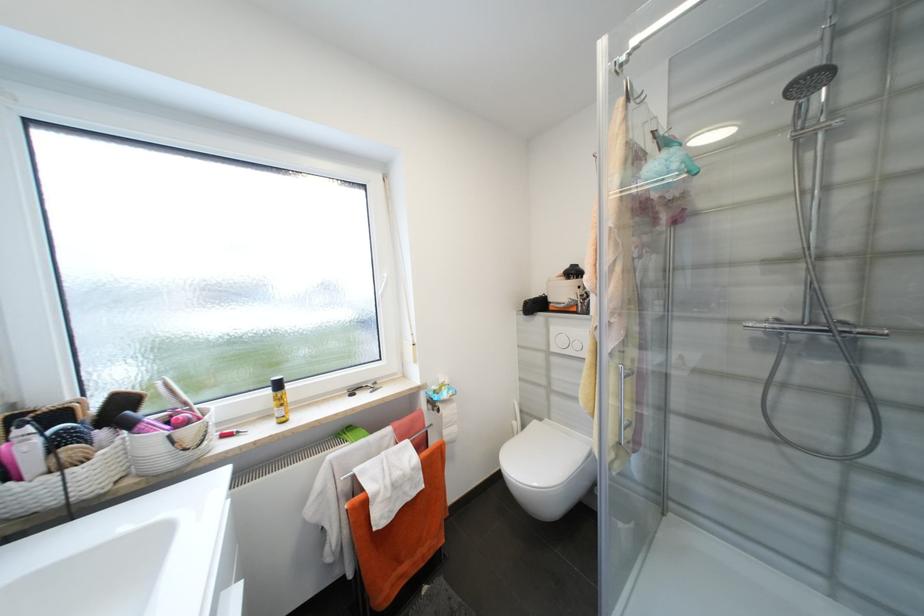
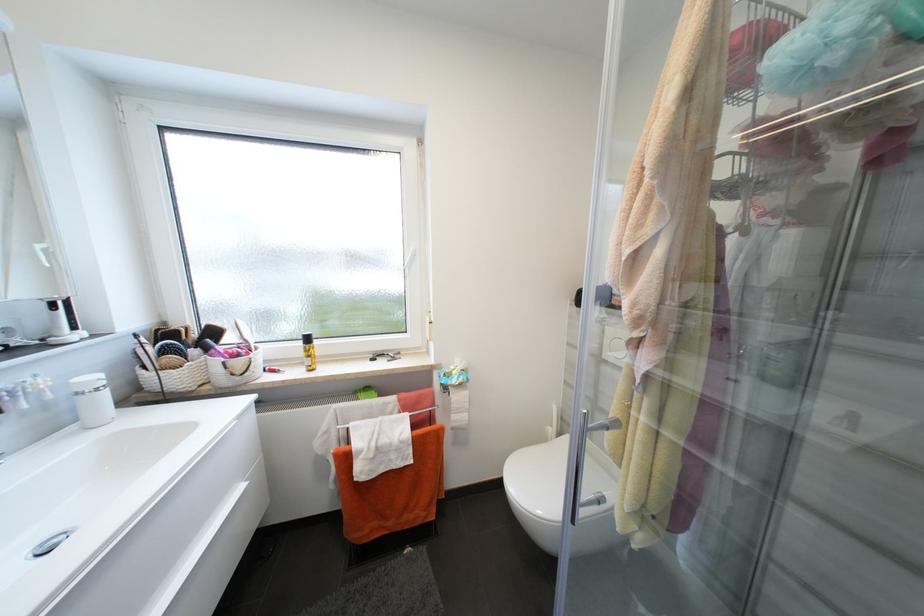
In a continuous first-person perspective shot, in which direction is the camera moving?

The cameraman moved toward right, forward.